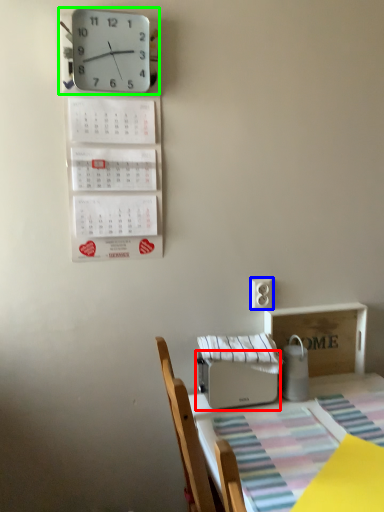
Question: Considering the real-world distances, which object is closest to appliance (highlighted by a red box)? electric outlet (highlighted by a blue box) or wall clock (highlighted by a green box).

Choices:
 (A) electric outlet
 (B) wall clock

Answer: (A)